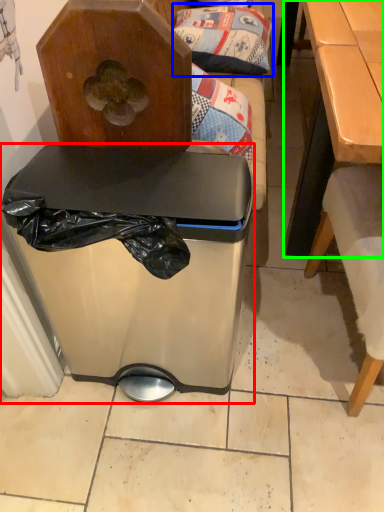
Question: Based on their relative distances, which object is farther from trash bin/can (highlighted by a red box)? Choose from pillow (highlighted by a blue box) and table (highlighted by a green box).

Choices:
 (A) pillow
 (B) table

Answer: (A)